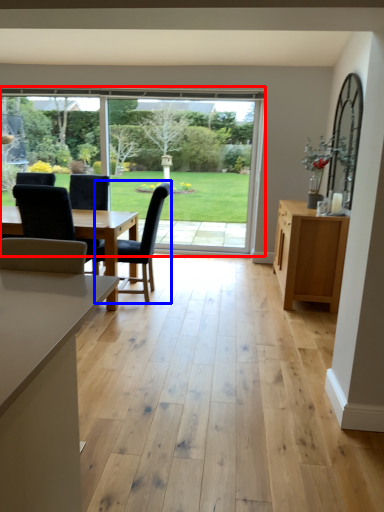
Question: Which object appears closest to the camera in this image, window (highlighted by a red box) or chair (highlighted by a blue box)?

Choices:
 (A) window
 (B) chair

Answer: (B)